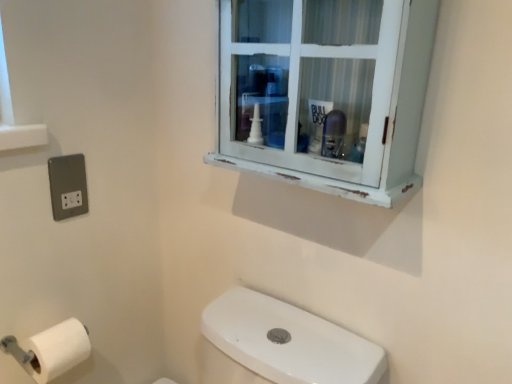
Image resolution: width=512 pixels, height=384 pixels. I want to click on white matte toilet paper at lower left, so click(57, 350).

Find the location of `satin silver socket at lower left`. satin silver socket at lower left is located at coordinates (68, 186).

You are a GUI agent. You are given a task and a screenshot of the screen. Output one action in this format:
    pyautogui.click(x=<x>, y=<y>)
    Task: Click on the white matte toilet paper at lower left
    Image resolution: width=512 pixels, height=384 pixels.
    Given the screenshot: What is the action you would take?
    click(57, 350)

Is white matte toilet paper at lower left wider than white distressed cabinet at upper center?

In fact, white matte toilet paper at lower left might be narrower than white distressed cabinet at upper center.

In terms of size, does white matte toilet paper at lower left appear bigger or smaller than white distressed cabinet at upper center?

Clearly, white matte toilet paper at lower left is smaller in size than white distressed cabinet at upper center.

Considering the relative positions of white matte toilet paper at lower left and white distressed cabinet at upper center in the image provided, is white matte toilet paper at lower left to the left of white distressed cabinet at upper center from the viewer's perspective?

Indeed, white matte toilet paper at lower left is positioned on the left side of white distressed cabinet at upper center.

Is white matte toilet paper at lower left turned away from white distressed cabinet at upper center?

No, white distressed cabinet at upper center is not at the back of white matte toilet paper at lower left.

Does point (229, 73) appear closer or farther from the camera than point (72, 157)?

Point (229, 73).

Between white distressed cabinet at upper center and satin silver socket at lower left, which one has larger width?

white distressed cabinet at upper center.

Is white distressed cabinet at upper center turned away from satin silver socket at lower left?

white distressed cabinet at upper center is not turned away from satin silver socket at lower left.

Considering the sizes of objects white distressed cabinet at upper center and satin silver socket at lower left in the image provided, who is smaller, white distressed cabinet at upper center or satin silver socket at lower left?

With smaller size is satin silver socket at lower left.

Considering the sizes of objects white matte toilet paper at lower left and satin silver socket at lower left in the image provided, who is thinner, white matte toilet paper at lower left or satin silver socket at lower left?

satin silver socket at lower left is thinner.

From a real-world perspective, relative to satin silver socket at lower left, is white matte toilet paper at lower left vertically above or below?

white matte toilet paper at lower left is situated lower than satin silver socket at lower left in the real world.

Considering the sizes of objects white matte toilet paper at lower left and satin silver socket at lower left in the image provided, who is shorter, white matte toilet paper at lower left or satin silver socket at lower left?

white matte toilet paper at lower left is shorter.

Does point (78, 359) appear closer or farther from the camera than point (50, 186)?

Point (78, 359).

Is satin silver socket at lower left wider or thinner than white distressed cabinet at upper center?

In the image, satin silver socket at lower left appears to be more narrow than white distressed cabinet at upper center.

Which object is closer to the camera, satin silver socket at lower left or white distressed cabinet at upper center?

white distressed cabinet at upper center is closer to the camera.

Which is more to the right, satin silver socket at lower left or white distressed cabinet at upper center?

white distressed cabinet at upper center.

How many degrees apart are the facing directions of satin silver socket at lower left and white distressed cabinet at upper center?

90.2 degrees separate the facing orientations of satin silver socket at lower left and white distressed cabinet at upper center.

Which is more to the left, satin silver socket at lower left or white matte toilet paper at lower left?

Positioned to the left is white matte toilet paper at lower left.

Between point (49, 163) and point (85, 334), which one is positioned in front?

Positioned in front is point (49, 163).

Considering the sizes of objects satin silver socket at lower left and white matte toilet paper at lower left in the image provided, who is wider, satin silver socket at lower left or white matte toilet paper at lower left?

With larger width is white matte toilet paper at lower left.

Is the surface of satin silver socket at lower left in direct contact with white matte toilet paper at lower left?

No, satin silver socket at lower left is not next to white matte toilet paper at lower left.

From the image's perspective, which one is positioned higher, white distressed cabinet at upper center or white matte toilet paper at lower left?

white distressed cabinet at upper center, from the image's perspective.

Relative to white matte toilet paper at lower left, is white distressed cabinet at upper center in front or behind?

Visually, white distressed cabinet at upper center is located in front of white matte toilet paper at lower left.

Considering the relative sizes of white distressed cabinet at upper center and white matte toilet paper at lower left in the image provided, is white distressed cabinet at upper center wider than white matte toilet paper at lower left?

Yes.

Is white distressed cabinet at upper center at the left side of white matte toilet paper at lower left?

Incorrect, white distressed cabinet at upper center is not on the left side of white matte toilet paper at lower left.

The image size is (512, 384). Find the location of `window above the white matte toilet paper at lower left (from the image's perspective)`. window above the white matte toilet paper at lower left (from the image's perspective) is located at coordinates (326, 92).

The width and height of the screenshot is (512, 384). In order to click on electric outlet behind the white distressed cabinet at upper center in this screenshot , I will do `click(68, 186)`.

From the image, which object appears to be farther from satin silver socket at lower left, white matte toilet paper at lower left or white distressed cabinet at upper center?

Based on the image, white distressed cabinet at upper center appears to be further to satin silver socket at lower left.

When comparing their distances from white matte toilet paper at lower left, does white distressed cabinet at upper center or satin silver socket at lower left seem closer?

satin silver socket at lower left is closer to white matte toilet paper at lower left.

Which object lies further to the anchor point white distressed cabinet at upper center, satin silver socket at lower left or white matte toilet paper at lower left?

white matte toilet paper at lower left is positioned further to the anchor white distressed cabinet at upper center.

From the image, which object appears to be nearer to white distressed cabinet at upper center, white matte toilet paper at lower left or satin silver socket at lower left?

The object closer to white distressed cabinet at upper center is satin silver socket at lower left.

Considering their positions, is satin silver socket at lower left positioned closer to white matte toilet paper at lower left than white distressed cabinet at upper center?

Among the two, satin silver socket at lower left is located nearer to white matte toilet paper at lower left.

Based on their spatial positions, is white distressed cabinet at upper center or white matte toilet paper at lower left closer to satin silver socket at lower left?

Among the two, white matte toilet paper at lower left is located nearer to satin silver socket at lower left.

Locate an element on the screen. The height and width of the screenshot is (384, 512). electric outlet between white matte toilet paper at lower left and white distressed cabinet at upper center from left to right is located at coordinates (68, 186).